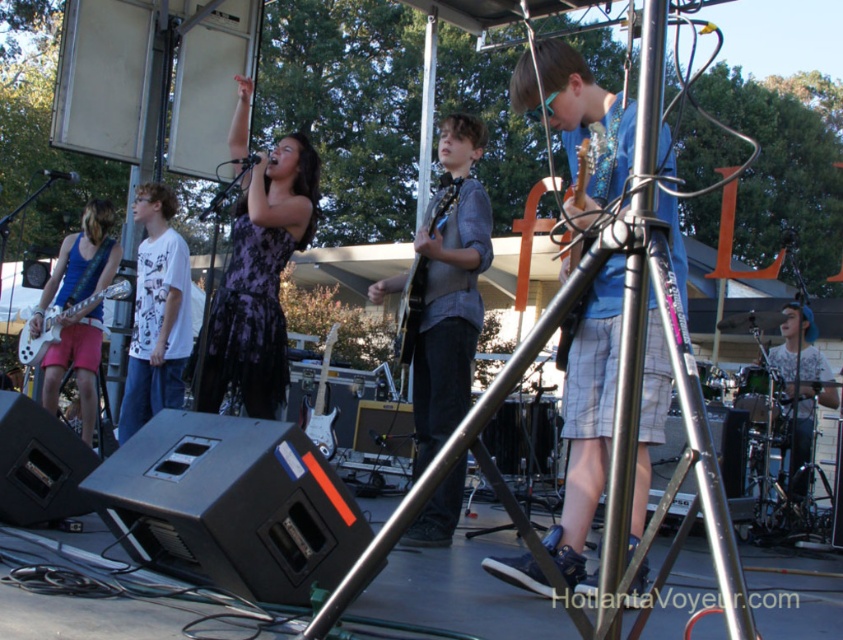
Question: Is the position of blue denim shorts at center less distant than that of glossy electric guitar at center?

Choices:
 (A) yes
 (B) no

Answer: (A)

Question: Which point is closer to the camera taking this photo?

Choices:
 (A) (403, 333)
 (B) (47, 301)
 (C) (50, 308)
 (D) (146, 241)

Answer: (A)

Question: Based on their relative distances, which object is farther from the glossy electric guitar at center?

Choices:
 (A) matte blue guitar at left
 (B) white glossy electric guitar at left

Answer: (A)

Question: Which of these objects is positioned closest to the purple floral dress at center?

Choices:
 (A) white printed t-shirt at left
 (B) matte blue guitar at left
 (C) blue denim shorts at center
 (D) glossy electric guitar at center

Answer: (D)

Question: Does denim shirt at center have a greater width compared to glossy electric guitar at center?

Choices:
 (A) yes
 (B) no

Answer: (A)

Question: Is blue denim shorts at center below glossy electric guitar at center?

Choices:
 (A) no
 (B) yes

Answer: (B)